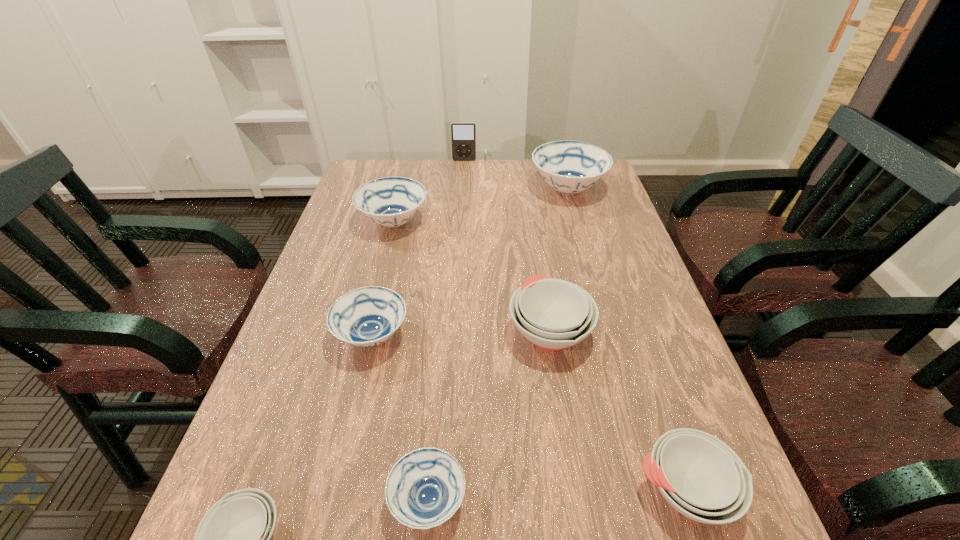
The image size is (960, 540). Find the location of `the tallest object`. the tallest object is located at coordinates (463, 134).

The height and width of the screenshot is (540, 960). I want to click on iPod, so click(x=463, y=134).

I want to click on the seventh shortest object, so click(570, 167).

Image resolution: width=960 pixels, height=540 pixels. Identify the location of the biggest blue soup bowl. (570, 167).

Where is `the third smallest blue soup bowl`? This screenshot has height=540, width=960. the third smallest blue soup bowl is located at coordinates (390, 201).

Find the location of a particular element. the second white soup bowl from right to left is located at coordinates (553, 314).

At what (x,y) coordinates should I click in order to perform the action: click on the biggest white soup bowl. Please return your answer as a coordinate pair (x, y). Looking at the image, I should click on (553, 314).

At what (x,y) coordinates should I click in order to perform the action: click on the second smallest blue soup bowl. Please return your answer as a coordinate pair (x, y). The image size is (960, 540). Looking at the image, I should click on (367, 316).

This screenshot has height=540, width=960. Identify the location of the second smallest white soup bowl. [x=700, y=476].

The width and height of the screenshot is (960, 540). Find the location of `free location located 0.230m on the front-facing side of the iPod`. free location located 0.230m on the front-facing side of the iPod is located at coordinates (462, 195).